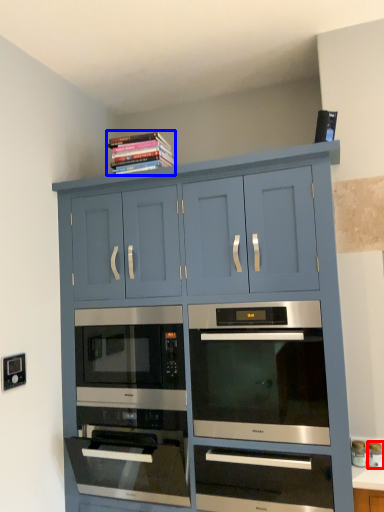
Question: Which of the following is the farthest to the observer, appliance (highlighted by a red box) or book (highlighted by a blue box)?

Choices:
 (A) appliance
 (B) book

Answer: (B)